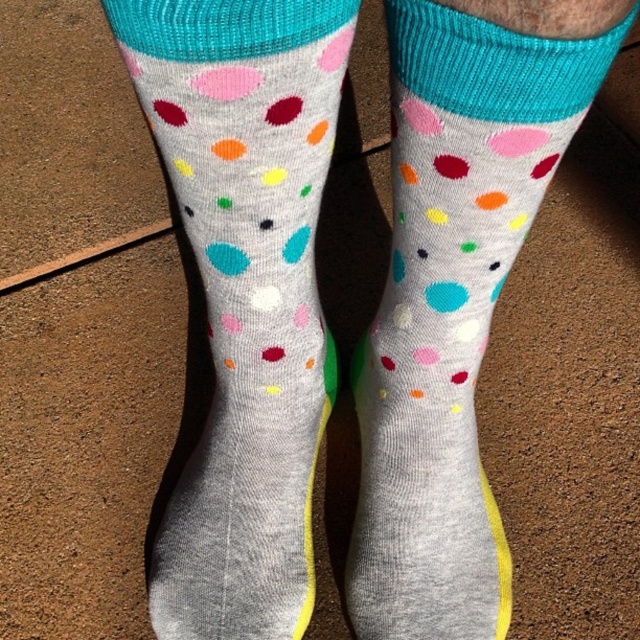
You are a fashion designer trying to create a matching outfit. You have two socks options in front of you, the gray cotton socks at center and the matte gray socks with colorful polka dots at center. Which sock would you choose if you want the larger size?

The gray cotton socks at center has a larger size compared to the matte gray socks with colorful polka dots at center, so you should choose the gray cotton socks at center.

You are a fashion designer trying to create a matching outfit. You have two socks in front of you, the gray cotton socks at center and the matte gray socks with colorful polka dots at center. If you want to place them side by side on a display stand, will they fit within a 6 inch wide space?

The gray cotton socks at center and the matte gray socks with colorful polka dots at center are 6.01 inches apart from each other, so they will not fit within a 6 inch wide space since the required space is slightly more than 6 inches.